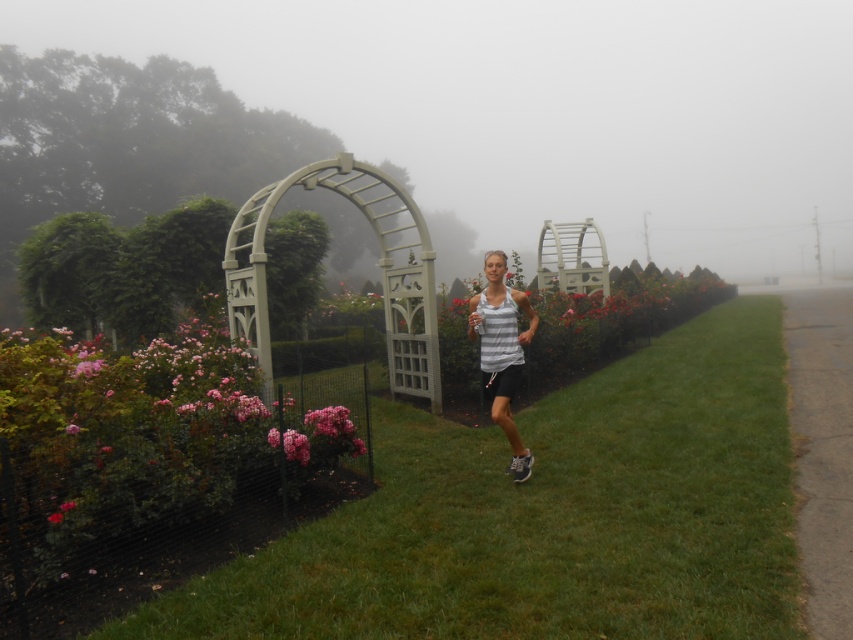
Does white striped tank top at center lie in front of pink matte flower at center-left?

That is False.

At what (x,y) coordinates should I click in order to perform the action: click on white striped tank top at center. Please return your answer as a coordinate pair (x, y). Looking at the image, I should click on (502, 349).

Which of these two, green leafy hedge at left or pink matte flower at center, stands shorter?

pink matte flower at center is shorter.

Between green leafy hedge at left and pink matte flower at center, which one is positioned higher?

Positioned higher is green leafy hedge at left.

Where is `green leafy hedge at left`? The height and width of the screenshot is (640, 853). green leafy hedge at left is located at coordinates (123, 269).

This screenshot has width=853, height=640. Describe the element at coordinates (123, 269) in the screenshot. I see `green leafy hedge at left` at that location.

Which is more to the right, green leafy hedge at left or pink matte flower at center-left?

pink matte flower at center-left

Which is behind, point (136, 308) or point (300, 440)?

Positioned behind is point (136, 308).

Find the location of a particular element. This screenshot has width=853, height=640. green leafy hedge at left is located at coordinates (123, 269).